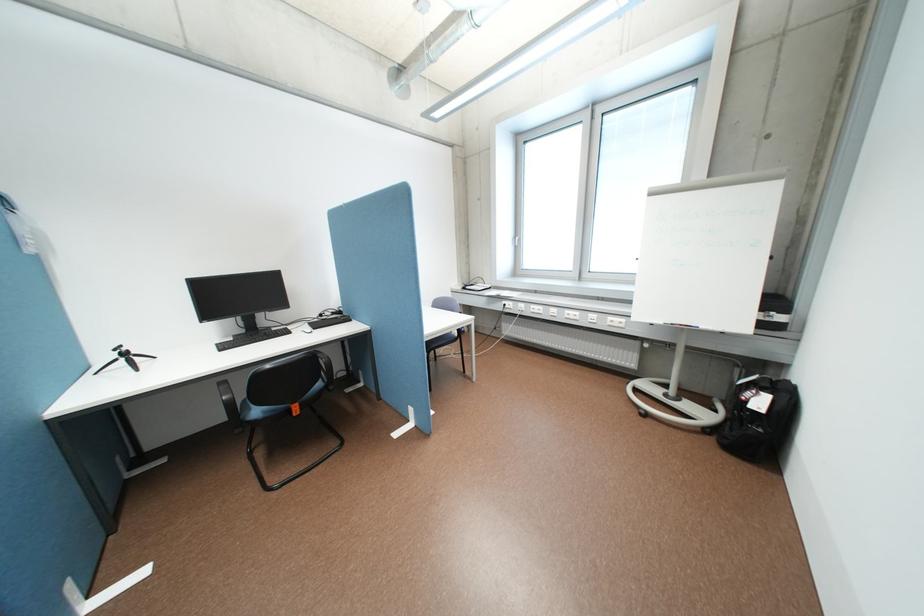
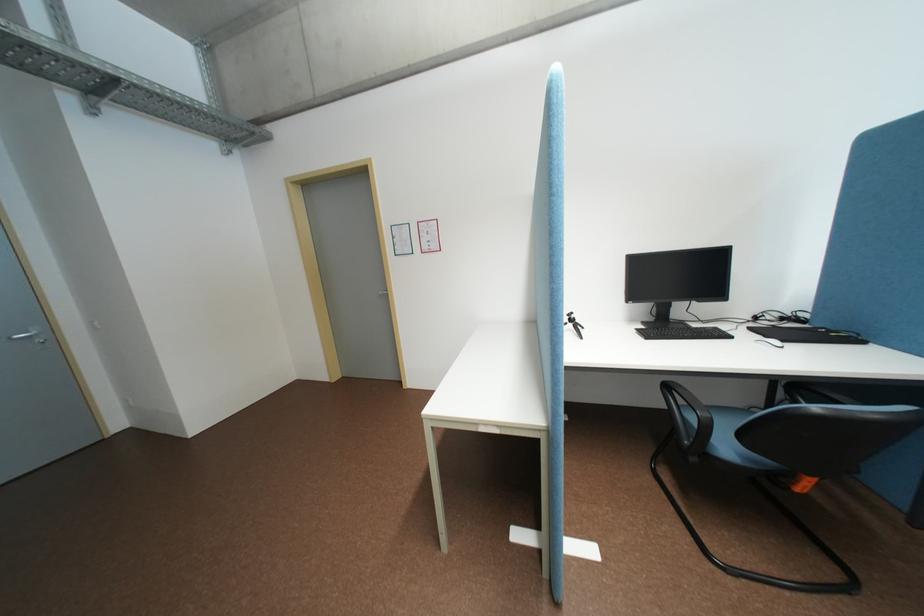
Locate, in the second image, the point that corresponds to (253,331) in the first image.

(662, 318)